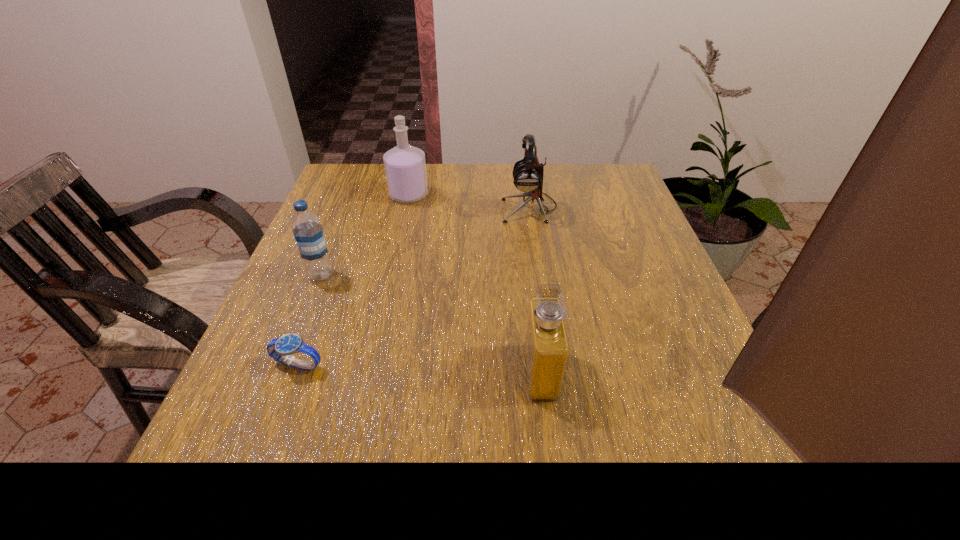
Find the location of `vacant space at the far edge of the desktop`. vacant space at the far edge of the desktop is located at coordinates (468, 167).

Locate an element on the screen. This screenshot has height=540, width=960. vacant space at the near edge of the desktop is located at coordinates (590, 509).

Locate an element on the screen. This screenshot has width=960, height=540. free spot at the left edge of the desktop is located at coordinates (350, 258).

Identify the location of free space at the right edge of the desktop. The image size is (960, 540). (659, 392).

In the image, there is a desktop. Where is `vacant space at the far left corner`? This screenshot has width=960, height=540. vacant space at the far left corner is located at coordinates (343, 197).

In the image, there is a desktop. Where is `vacant space at the near left corner`? Image resolution: width=960 pixels, height=540 pixels. vacant space at the near left corner is located at coordinates (233, 523).

Where is `vacant space at the far right corner of the desktop`? vacant space at the far right corner of the desktop is located at coordinates (613, 179).

Identify the location of vacant area between the water bottle and the third object from left to right. The width and height of the screenshot is (960, 540). (365, 235).

Find the location of a particular element. Image resolution: width=960 pixels, height=540 pixels. free spot between the left perfume and the earphone is located at coordinates (469, 201).

What are the coordinates of `empty space between the farther perfume and the nearer perfume` in the screenshot? It's located at (475, 284).